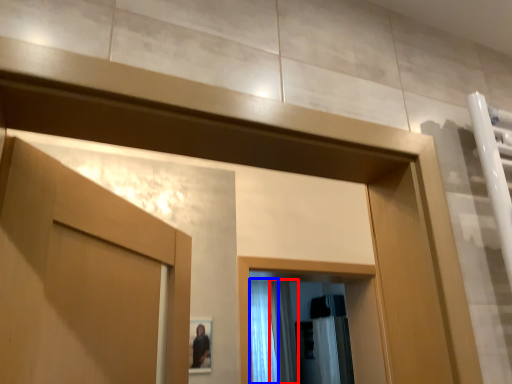
Question: Which point is further to the camera, shower curtain (highlighted by a red box) or shower curtain (highlighted by a blue box)?

Choices:
 (A) shower curtain
 (B) shower curtain

Answer: (A)